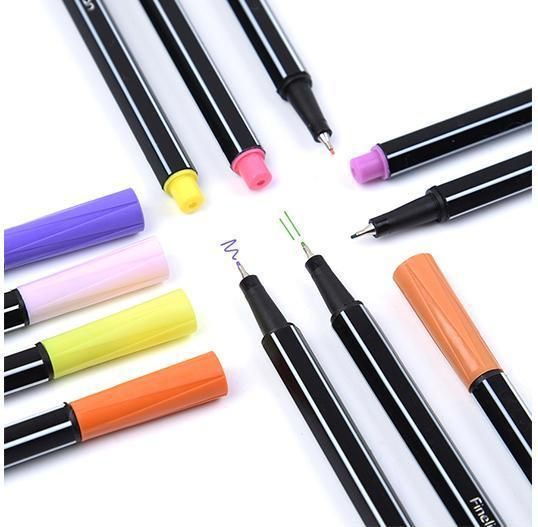
Where is `markers`? The width and height of the screenshot is (538, 527). markers is located at coordinates [436, 297], [148, 385], [129, 330], [110, 281], [106, 228], [181, 197], [257, 175], [400, 161].